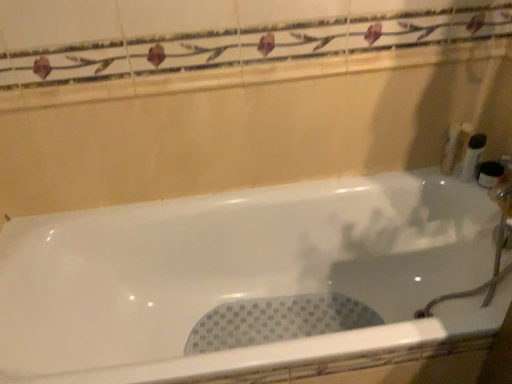
Question: Looking at the image, does white plastic bottle at right, arranged as the 3th toiletry when viewed from the left, seem bigger or smaller compared to white plastic bottle at right, the fourth toiletry from the right?

Choices:
 (A) big
 (B) small

Answer: (B)

Question: Considering the relative positions of white plastic bottle at right, arranged as the 3th toiletry when viewed from the left, and white plastic bottle at right, placed as the 1th toiletry when sorted from left to right, in the image provided, is white plastic bottle at right, arranged as the 3th toiletry when viewed from the left, to the left or to the right of white plastic bottle at right, placed as the 1th toiletry when sorted from left to right,?

Choices:
 (A) right
 (B) left

Answer: (A)

Question: Considering the real-world distances, which object is closest to the white plastic bottle at right, which is the second toiletry in right-to-left order?

Choices:
 (A) white glossy bathtub at center
 (B) white plastic container at right, the third toiletry in the right-to-left sequence
 (C) white plastic bottle at right, the 1th toiletry from the right
 (D) white plastic bottle at right, placed as the 1th toiletry when sorted from left to right

Answer: (B)

Question: Which is farther from the white plastic bottle at right, placed as the 1th toiletry when sorted from left to right?

Choices:
 (A) white glossy bathtub at center
 (B) white plastic bottle at right, which is the second toiletry in right-to-left order
 (C) white plastic bottle at right, the 1th toiletry from the right
 (D) white plastic container at right, the 2th toiletry in the left-to-right sequence

Answer: (A)